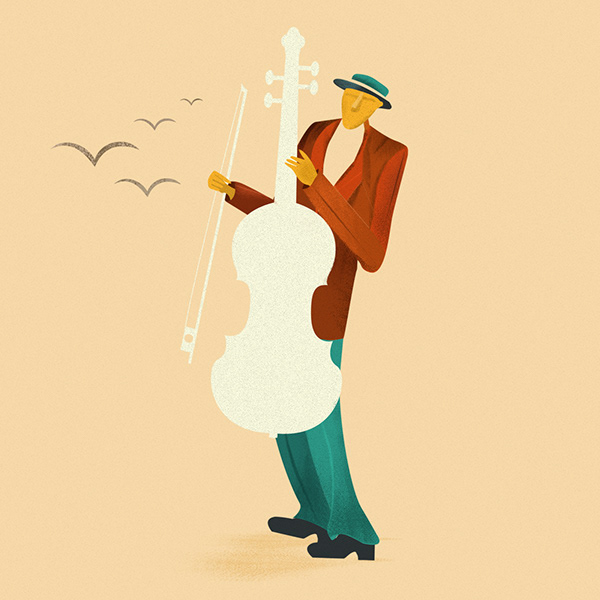
Where is `artwork`? This screenshot has height=600, width=600. artwork is located at coordinates (269, 216).